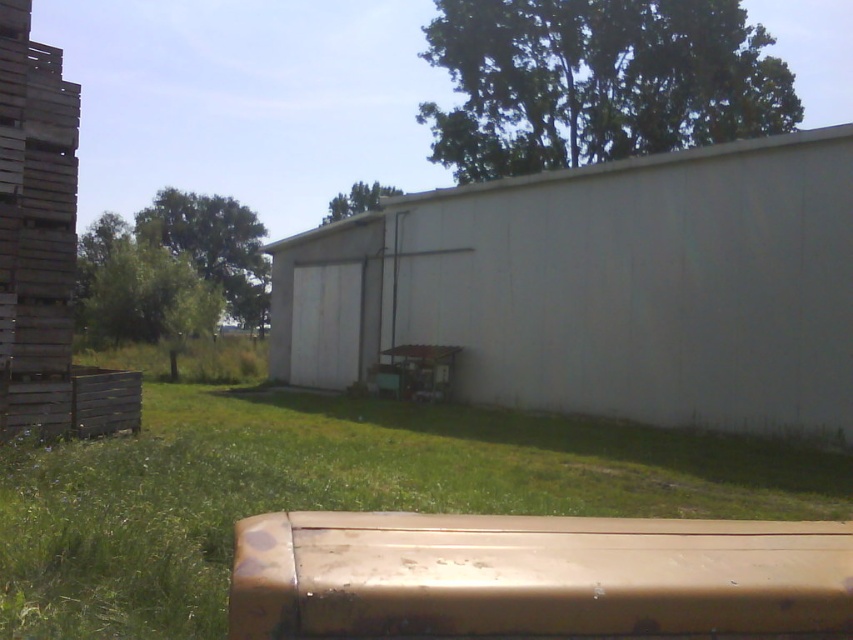
Can you confirm if white concrete wall at center is smaller than green grass at lower center?

Incorrect, white concrete wall at center is not smaller in size than green grass at lower center.

Between white concrete wall at center and green grass at lower center, which one is positioned lower?

Positioned lower is green grass at lower center.

Which is behind, point (281, 294) or point (129, 636)?

The point (281, 294) is behind.

Identify the location of white concrete wall at center. (601, 289).